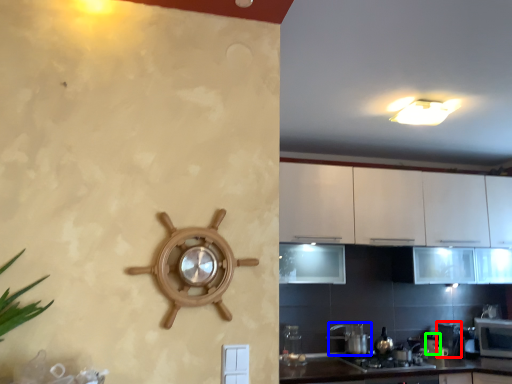
Question: Based on their relative distances, which object is nearer to appliance (highlighted by a red box)? Choose from appliance (highlighted by a blue box) and appliance (highlighted by a green box).

Choices:
 (A) appliance
 (B) appliance

Answer: (B)